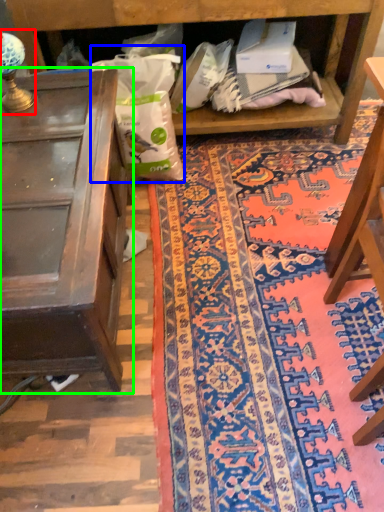
Question: Considering the real-world distances, which object is closest to lamp (highlighted by a red box)? paper bag (highlighted by a blue box) or table (highlighted by a green box).

Choices:
 (A) paper bag
 (B) table

Answer: (B)